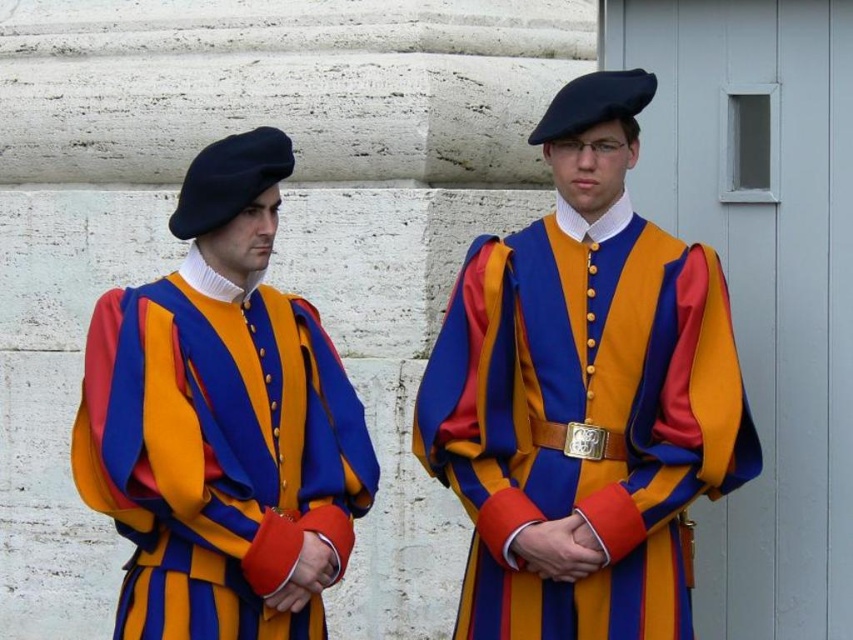
You are a photographer adjusting your camera settings to capture a clear image of both points mentioned. Given that point A is at point (592, 342) and point B is at point (282, 630), which point is closer to your camera lens?

Point B at (282, 630) is closer to the camera lens than point A at (592, 342) because the description states that point A is further away from the camera compared to point B.

From the picture: You are a tailor measuring a uniform for a client. The uniform in the image is located at point (584, 396). Based on the description, what material is the uniform made of?

The uniform at point (584, 396) is made of matte woolen material.

You are a tailor measuring the distance between the matte woolen uniform at center and the matte wool beret at left for a custom fitting. The minimum required distance for accurate measurements is 1.5 meters. Can you proceed with the measurements as they are?

The matte woolen uniform at center and matte wool beret at left are 1.68 meters apart from each other, which exceeds the minimum required distance of 1.5 meters. Therefore, you can proceed with the measurements as they are.